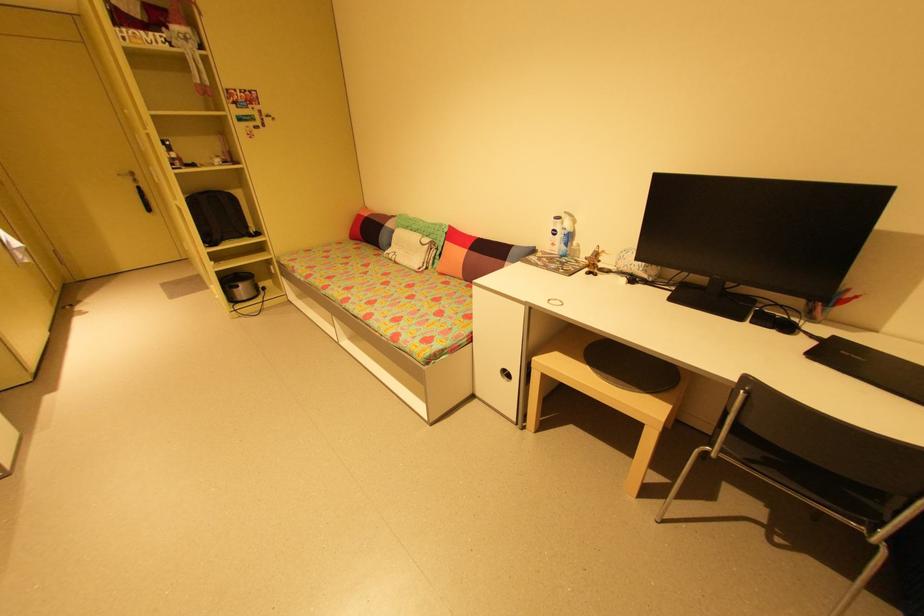
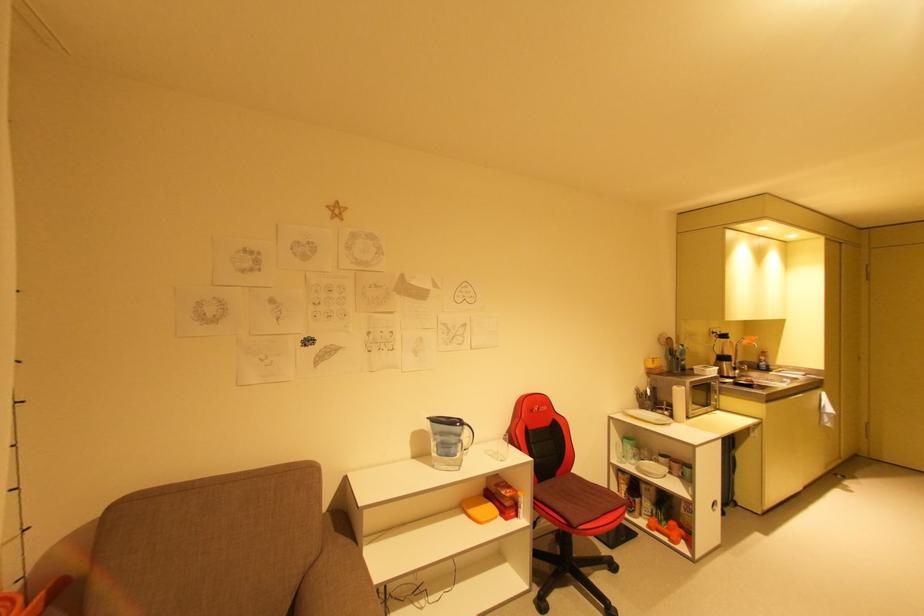
Question: Based on the continuous images, in which direction is the camera rotating? Reply with the corresponding letter.

Choices:
 (A) Left
 (B) Right
 (C) Up
 (D) Down

Answer: (A)